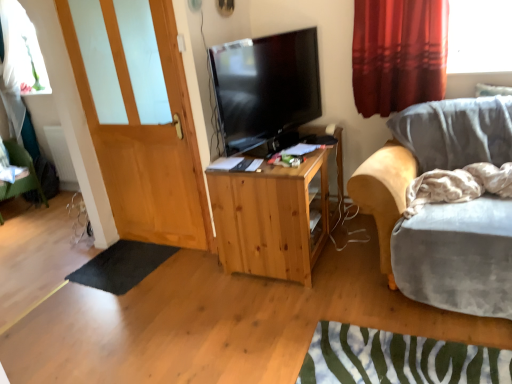
The width and height of the screenshot is (512, 384). I want to click on blank space above black rubber mat at lower left (from a real-world perspective), so click(x=125, y=261).